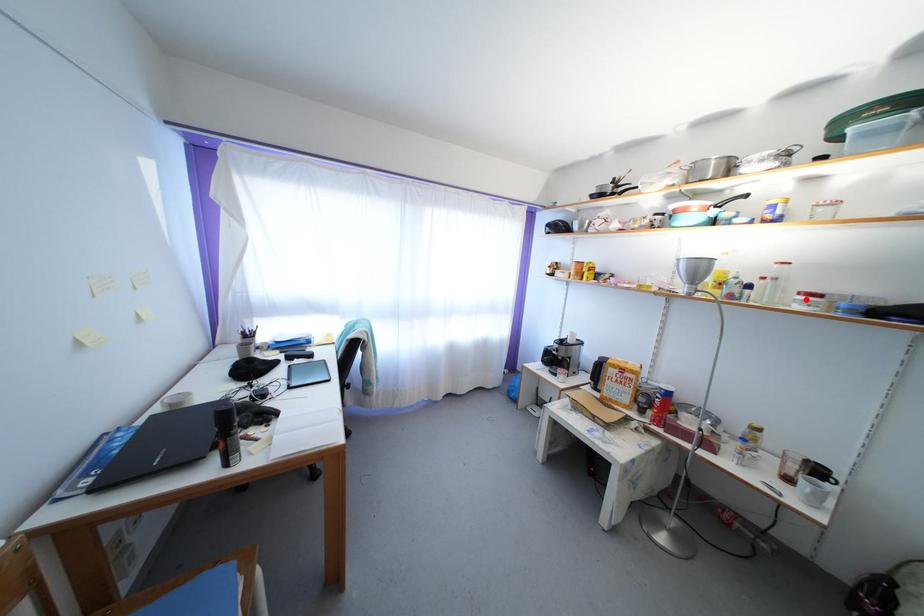
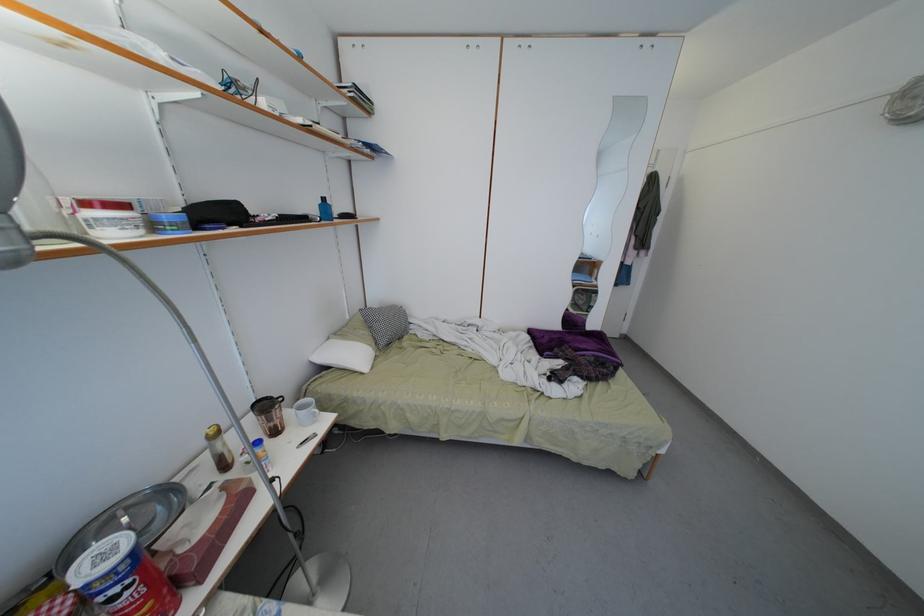
Locate, in the second image, the point that corresponds to the highlighted location in the first image.

(91, 209)